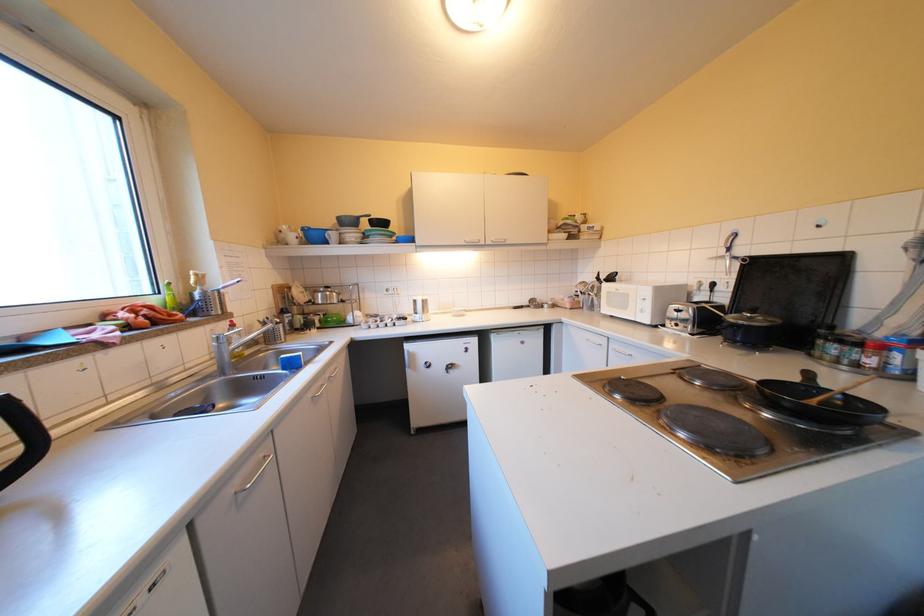
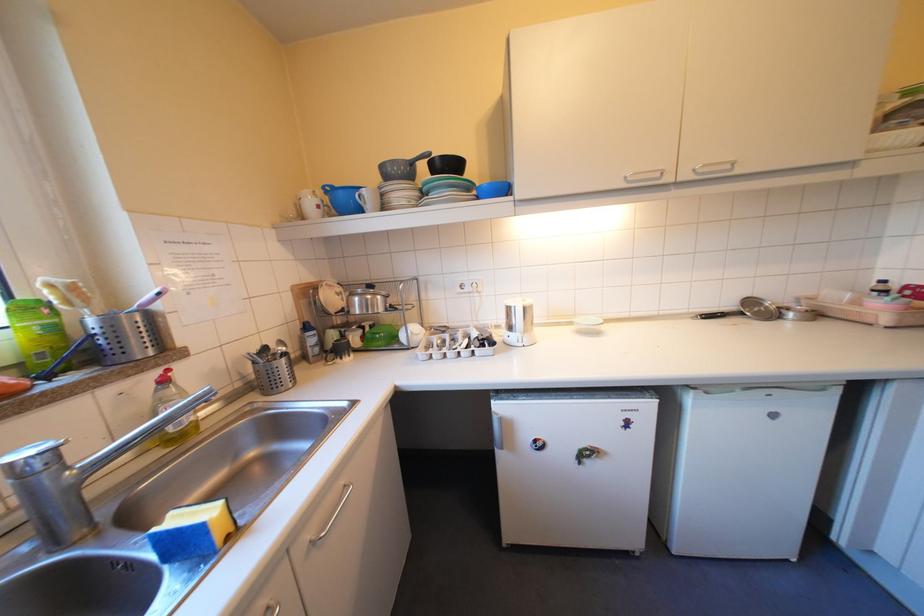
Where in the second image is the point corresponding to [238,322] from the first image?

(168, 371)